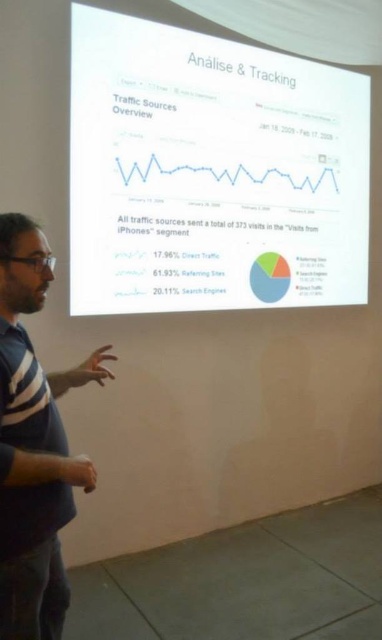
Does point (236, 193) come closer to viewer compared to point (0, 403)?

No, (236, 193) is further to viewer.

Between point (194, 54) and point (3, 266), which one is positioned in front?

Positioned in front is point (3, 266).

I want to click on white glossy projector screen at upper center, so click(x=212, y=172).